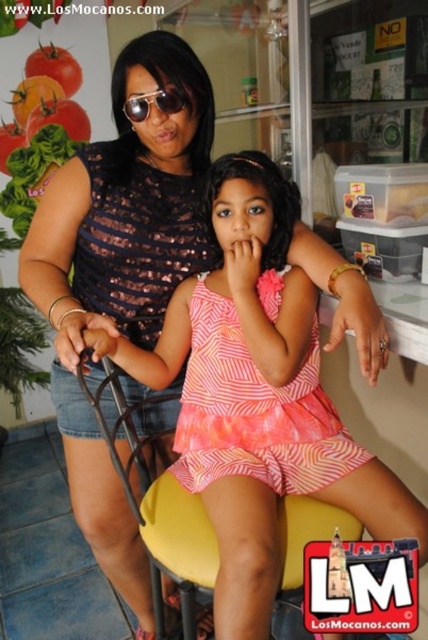
Who is shorter, pink zebra-patterned dress at center or shiny metallic sunglasses at center?

shiny metallic sunglasses at center is shorter.

I want to click on pink zebra-patterned dress at center, so click(253, 397).

What do you see at coordinates (253, 397) in the screenshot?
I see `pink zebra-patterned dress at center` at bounding box center [253, 397].

This screenshot has height=640, width=428. I want to click on pink zebra-patterned dress at center, so click(x=253, y=397).

Can you confirm if pink tie-dye dress at center is positioned above shiny metallic sunglasses at center?

Incorrect, pink tie-dye dress at center is not positioned above shiny metallic sunglasses at center.

Consider the image. Who is more forward, (196, 355) or (136, 97)?

Point (136, 97) is in front.

Where is `pink tie-dye dress at center`? This screenshot has height=640, width=428. pink tie-dye dress at center is located at coordinates (253, 412).

Is pink tie-dye dress at center positioned at the back of yellow fabric chair at center?

That is True.

In the scene shown: Is pink tie-dye dress at center taller than yellow fabric chair at center?

Incorrect, pink tie-dye dress at center's height is not larger of yellow fabric chair at center's.

Does point (297, 428) come farther from viewer compared to point (104, 380)?

No, it is in front of (104, 380).

You are a GUI agent. You are given a task and a screenshot of the screen. Output one action in this format:
    pyautogui.click(x=<x>, y=<y>)
    Task: Click on the pink tie-dye dress at center
    Image resolution: width=428 pixels, height=640 pixels.
    Given the screenshot: What is the action you would take?
    pyautogui.click(x=253, y=412)